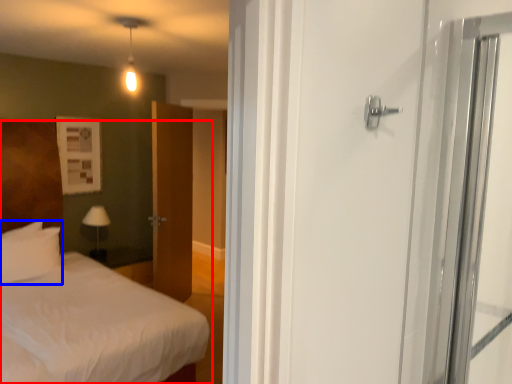
Question: Among these objects, which one is nearest to the camera, bed (highlighted by a red box) or pillow (highlighted by a blue box)?

Choices:
 (A) bed
 (B) pillow

Answer: (A)